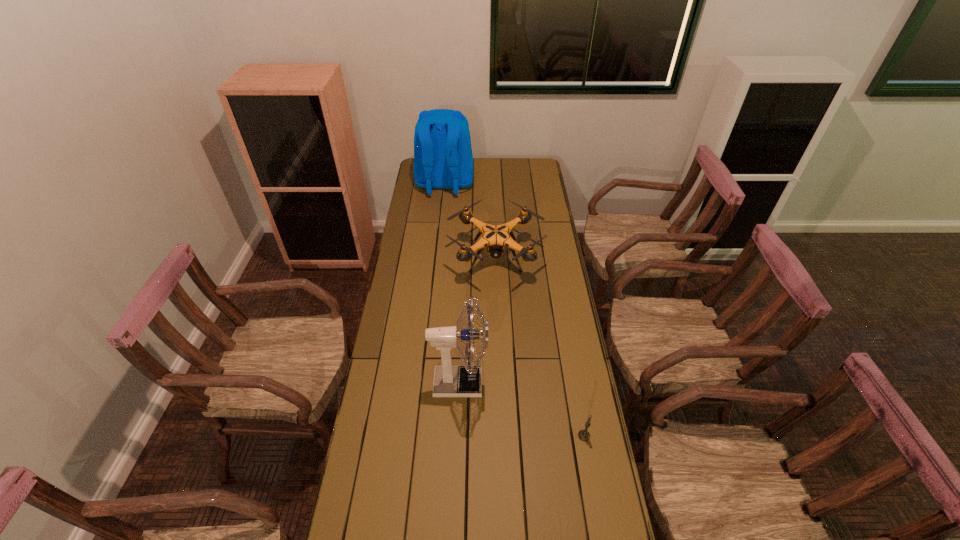
Find the location of a particular element. The image size is (960, 540). the farthest object is located at coordinates (443, 159).

The height and width of the screenshot is (540, 960). Find the location of `fan`. fan is located at coordinates (449, 381).

At what (x,y) coordinates should I click in order to perform the action: click on the second shortest object. Please return your answer as a coordinate pair (x, y). Image resolution: width=960 pixels, height=540 pixels. Looking at the image, I should click on (495, 238).

I want to click on the third nearest object, so click(495, 238).

I want to click on the shortest object, so click(583, 435).

What are the coordinates of `candle` in the screenshot? It's located at (583, 435).

Find the location of `free space located 0.180m on the back of the backpack`. free space located 0.180m on the back of the backpack is located at coordinates (441, 223).

Identify the location of free spot located on the front-facing side of the fan. This screenshot has height=540, width=960. (549, 383).

The height and width of the screenshot is (540, 960). I want to click on vacant area situated on the camera mount of the second farthest object, so point(499,366).

At what (x,y) coordinates should I click in order to perform the action: click on vacant space located on the front of the candle. Please return your answer as a coordinate pair (x, y). The image size is (960, 540). Looking at the image, I should click on (602, 536).